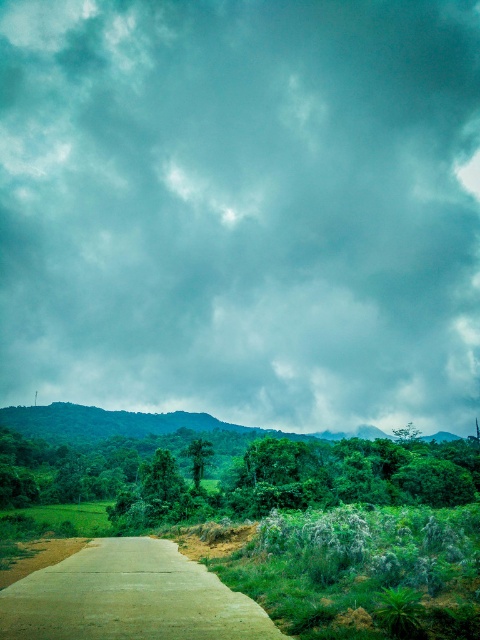
You are a hiker planning to walk along the concrete road at center in the image. You want to know if the green leafy trees at center are positioned above or below the road. Can you tell me their relative position?

The green leafy trees at center are located below the concrete road at center, so they are positioned underneath the road from your perspective.

You are a landscape photographer planning to capture the width of the green leafy trees at center and the concrete road at center in your shot. Which object would require a wider angle lens to fully capture its width in the frame?

The green leafy trees at center have a larger width than the concrete road at center, so you would need a wider angle lens to fully capture the width of the green leafy trees at center in the frame.